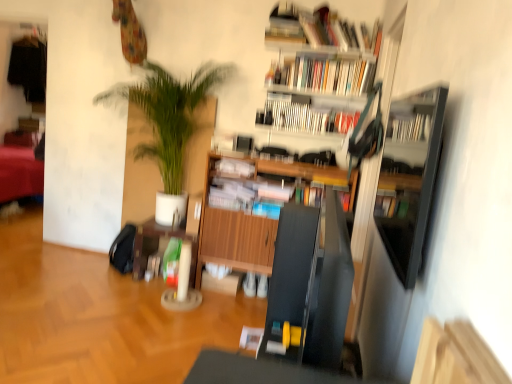
Question: Is black glossy shelf at right, positioned as the first shelf in front-to-back order, spatially inside white paper at center, positioned as the fourth book in top-to-bottom order, or outside of it?

Choices:
 (A) inside
 (B) outside

Answer: (B)

Question: From the image's perspective, relative to white paper at center, which appears as the 1th book when ordered from the bottom, is black glossy shelf at right, positioned as the first shelf in front-to-back order, above or below?

Choices:
 (A) below
 (B) above

Answer: (A)

Question: Which object is positioned farthest from the white paper at center, which appears as the 1th book when ordered from the bottom?

Choices:
 (A) hardcover books at upper center, the fourth book positioned from the bottom
 (B) wooden bookshelf at upper center
 (C) wooden cabinet at center
 (D) hardcover book at upper center, which appears as the third book when viewed from the top
 (E) green leafy plant at upper left

Answer: (A)

Question: Which object is positioned closest to the hardcover book at upper center, which is counted as the 2th book, starting from the bottom?

Choices:
 (A) wooden bookshelf at upper center
 (B) hardcover books at upper center, placed as the first book when sorted from top to bottom
 (C) hardcover books at upper center, the third book from the bottom
 (D) green leafy plant at upper left
 (E) wooden cabinet at center, which is counted as the second shelf, starting from the front

Answer: (C)